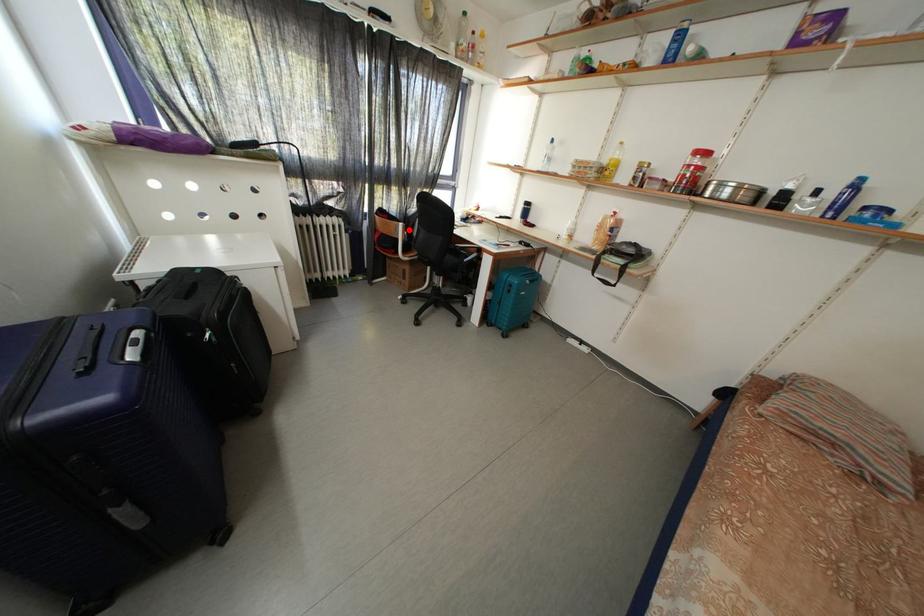
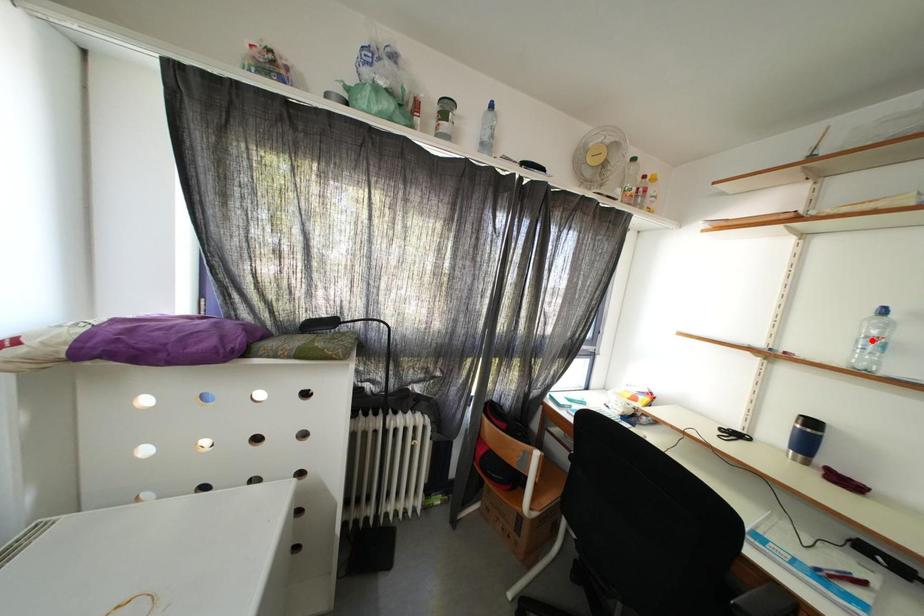
I am providing you with two images of the same scene from different viewpoints. A red point is marked on the first image and another point is marked on the second image. Do the highlighted points in image1 and image2 indicate the same real-world spot?

No